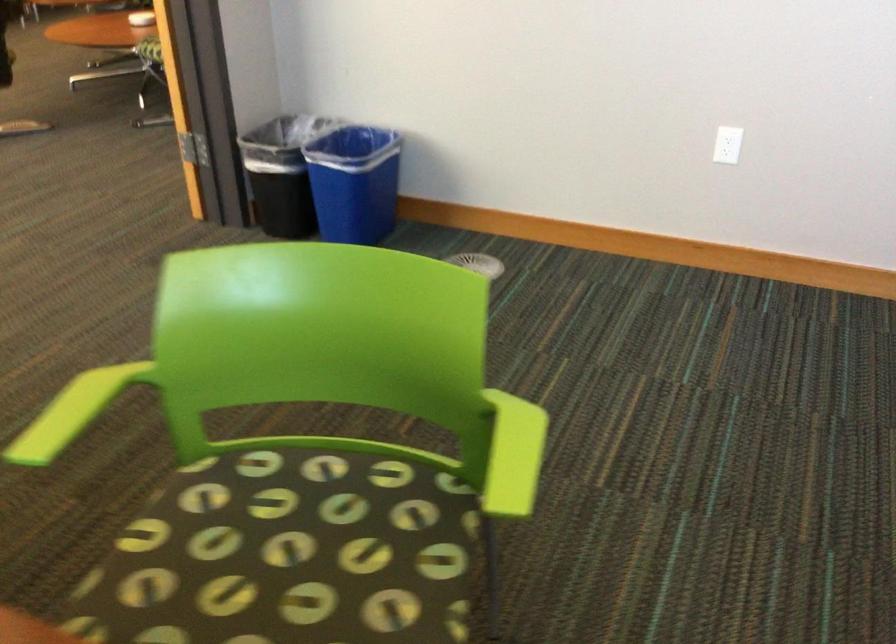
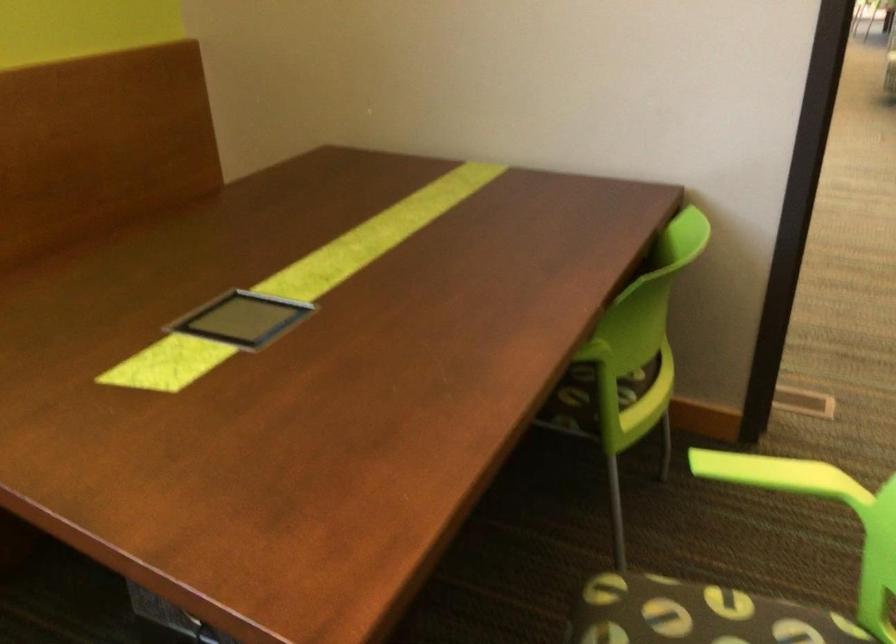
The first image is from the beginning of the video and the second image is from the end. How did the camera likely rotate when shooting the video?

The rotation direction of the camera is left-down.